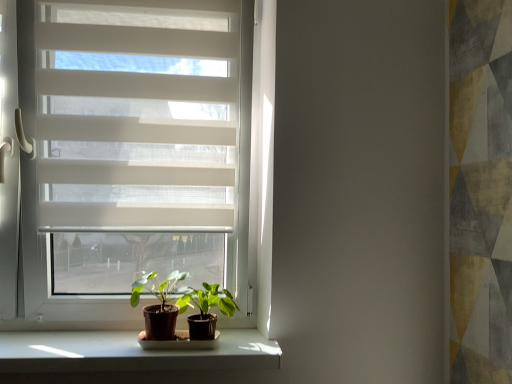
Find the location of a particular element. This screenshot has width=512, height=384. free area in between green matte plant at center, which appears as the first houseplant when viewed from the right, and white matte window at center is located at coordinates (111, 351).